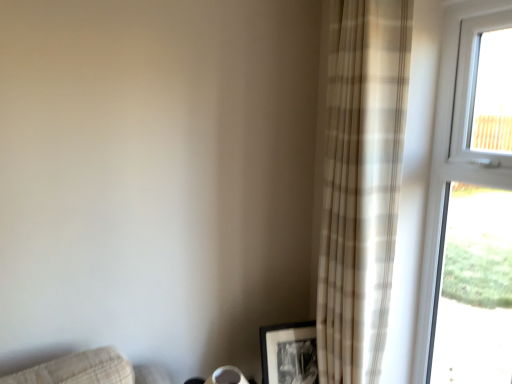
Question: From the image's perspective, is beige plaid curtain at right beneath white plastic window at upper right?

Choices:
 (A) no
 (B) yes

Answer: (A)

Question: Considering the relative sizes of beige plaid curtain at right and white plastic window at upper right in the image provided, is beige plaid curtain at right wider than white plastic window at upper right?

Choices:
 (A) yes
 (B) no

Answer: (A)

Question: Does beige plaid curtain at right have a lesser height compared to white plastic window at upper right?

Choices:
 (A) no
 (B) yes

Answer: (A)

Question: Are beige plaid curtain at right and white plastic window at upper right making contact?

Choices:
 (A) no
 (B) yes

Answer: (A)

Question: Is beige plaid curtain at right oriented away from white plastic window at upper right?

Choices:
 (A) yes
 (B) no

Answer: (B)

Question: From the image's perspective, is black matte picture frame at lower right positioned above or below white plastic window at upper right?

Choices:
 (A) below
 (B) above

Answer: (A)

Question: Is black matte picture frame at lower right bigger or smaller than white plastic window at upper right?

Choices:
 (A) big
 (B) small

Answer: (B)

Question: From a real-world perspective, is black matte picture frame at lower right positioned above or below white plastic window at upper right?

Choices:
 (A) above
 (B) below

Answer: (B)

Question: Does point (262, 347) appear closer or farther from the camera than point (483, 266)?

Choices:
 (A) farther
 (B) closer

Answer: (A)

Question: Looking at their shapes, would you say beige plaid curtain at right is wider or thinner than white plastic window at upper right?

Choices:
 (A) thin
 (B) wide

Answer: (B)

Question: Considering the positions of point (347, 54) and point (481, 135), is point (347, 54) closer or farther from the camera than point (481, 135)?

Choices:
 (A) closer
 (B) farther

Answer: (A)

Question: Considering the positions of beige plaid curtain at right and white plastic window at upper right in the image, is beige plaid curtain at right bigger or smaller than white plastic window at upper right?

Choices:
 (A) small
 (B) big

Answer: (B)

Question: In the image, is beige plaid curtain at right on the left side or the right side of white plastic window at upper right?

Choices:
 (A) right
 (B) left

Answer: (B)

Question: Is white plastic window at upper right wider or thinner than black matte picture frame at lower right?

Choices:
 (A) wide
 (B) thin

Answer: (B)

Question: Is white plastic window at upper right taller or shorter than black matte picture frame at lower right?

Choices:
 (A) tall
 (B) short

Answer: (A)